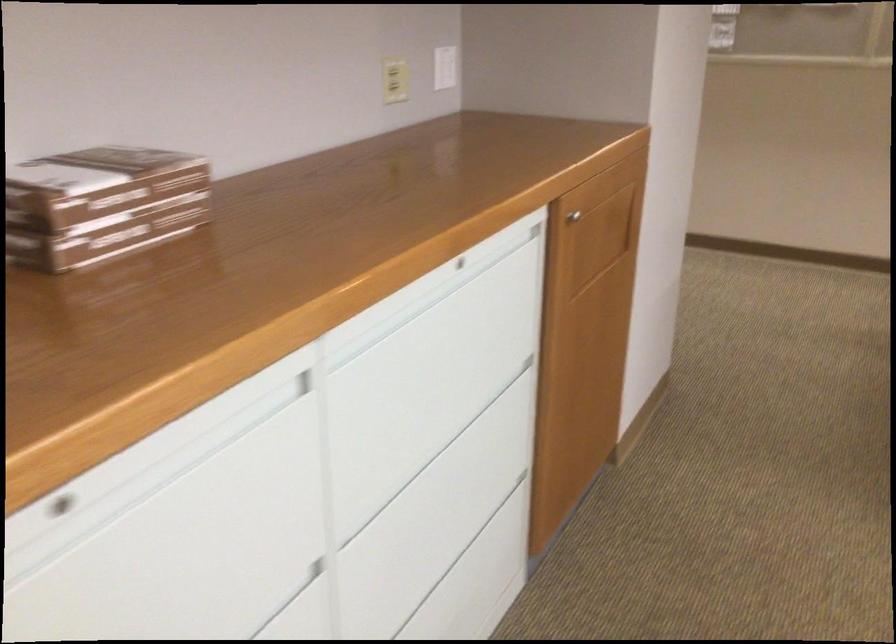
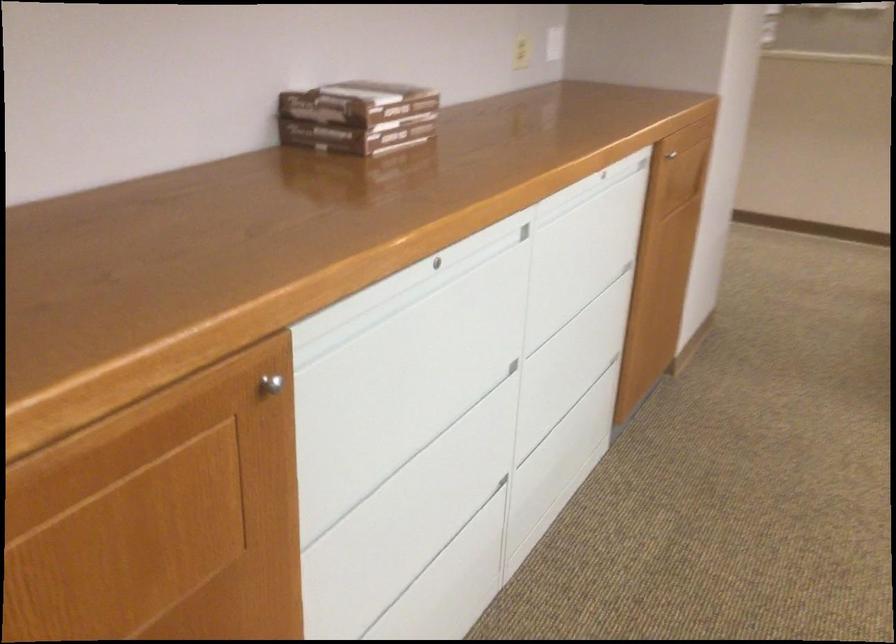
In the second image, find the point that corresponds to point (83, 489) in the first image.

(435, 261)